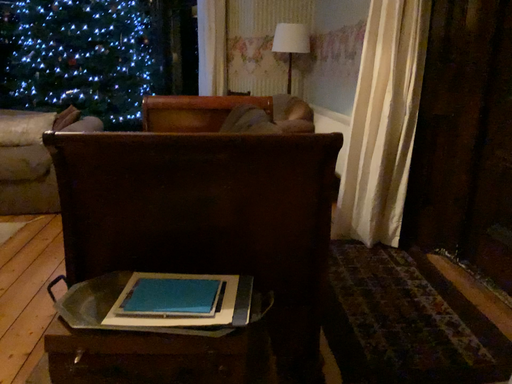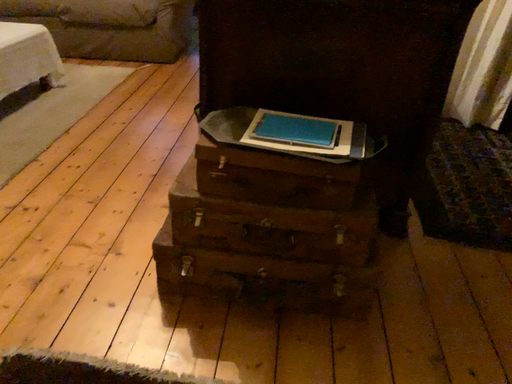
Question: How did the camera likely rotate when shooting the video?

Choices:
 (A) rotated downward
 (B) rotated upward

Answer: (A)